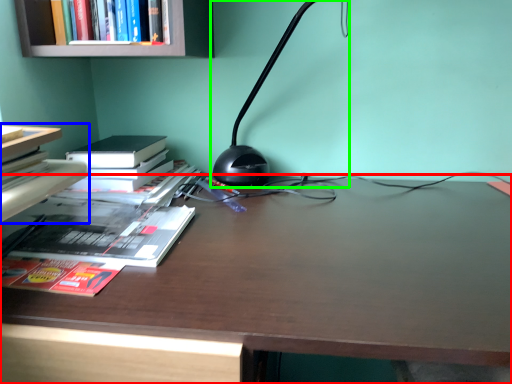
Question: Which is farther away from desk (highlighted by a red box)? book (highlighted by a blue box) or lamp (highlighted by a green box)?

Choices:
 (A) book
 (B) lamp

Answer: (A)